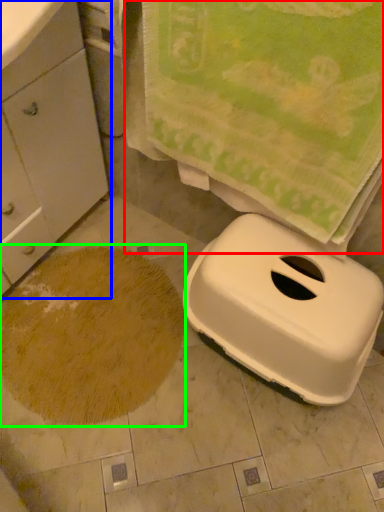
Question: Based on their relative distances, which object is farther from beach towel (highlighted by a red box)? Choose from cabinetry (highlighted by a blue box) and sand (highlighted by a green box).

Choices:
 (A) cabinetry
 (B) sand

Answer: (B)